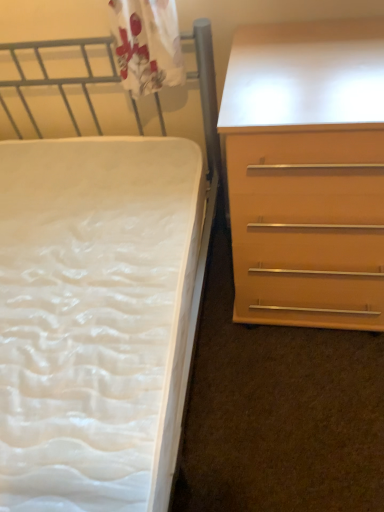
Identify the location of free space in front of light brown wood chest of drawers at right. Image resolution: width=384 pixels, height=512 pixels. (304, 407).